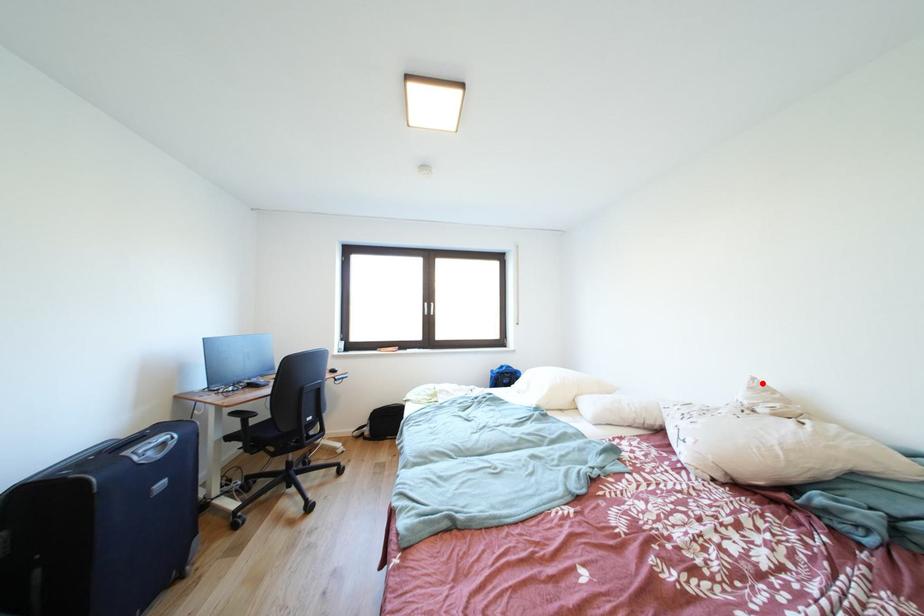
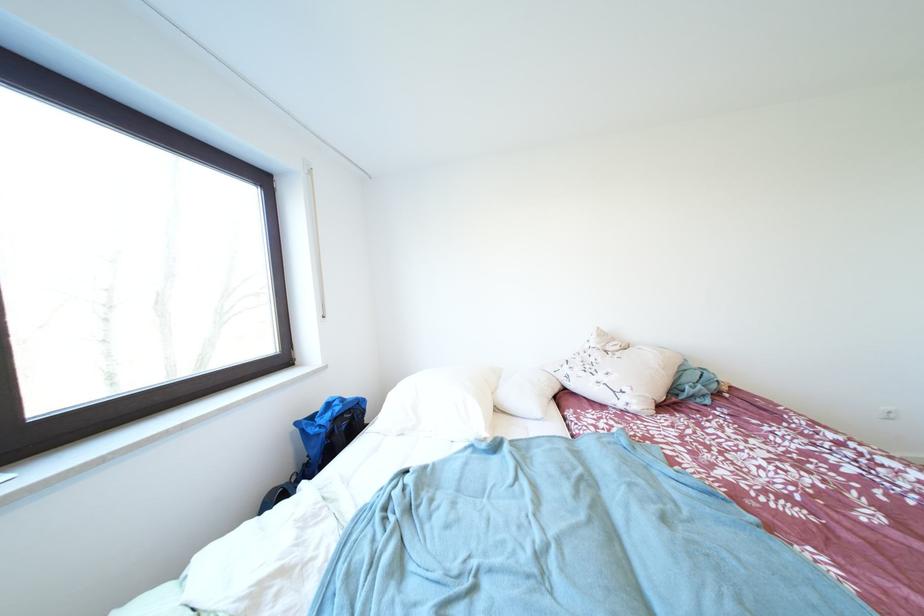
Where in the second image is the point corresponding to the highlighted location from the first image?

(606, 333)